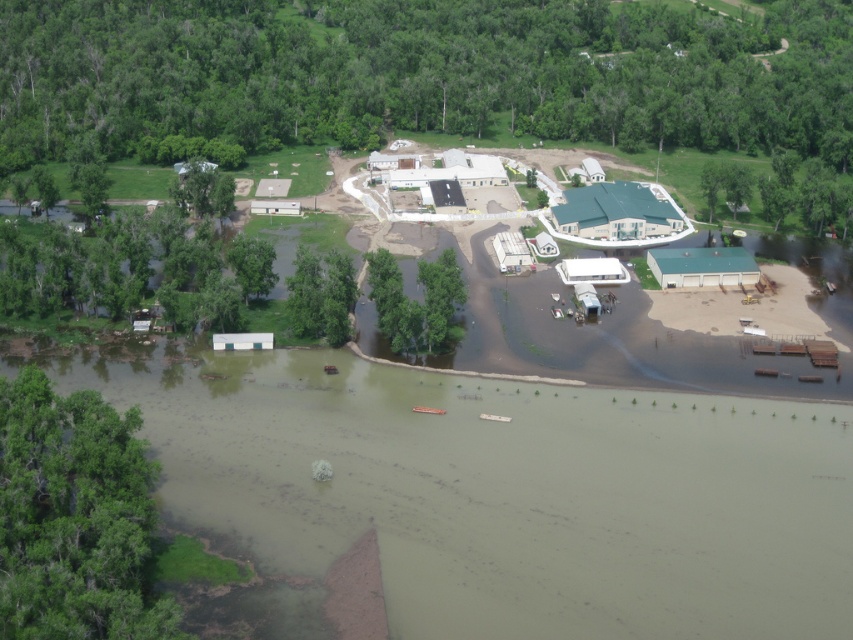
Question: Which object is closer to the camera taking this photo?

Choices:
 (A) green leafy tree at center
 (B) green matte tree at upper left
 (C) green leafy tree at upper center
 (D) green leafy tree at lower left

Answer: (D)

Question: Is the position of green leafy tree at upper center less distant than that of green matte tree at upper left?

Choices:
 (A) yes
 (B) no

Answer: (B)

Question: Considering the real-world distances, which object is closest to the green matte tree at upper left?

Choices:
 (A) green leafy tree at upper center
 (B) green leafy tree at center

Answer: (B)

Question: Is green leafy tree at lower left to the right of green leafy tree at center from the viewer's perspective?

Choices:
 (A) yes
 (B) no

Answer: (B)

Question: Estimate the real-world distances between objects in this image. Which object is farther from the green leafy tree at upper center?

Choices:
 (A) green leafy tree at lower left
 (B) green matte tree at upper left
 (C) green leafy tree at center

Answer: (A)

Question: Does green leafy tree at upper center appear over green matte tree at upper left?

Choices:
 (A) no
 (B) yes

Answer: (B)